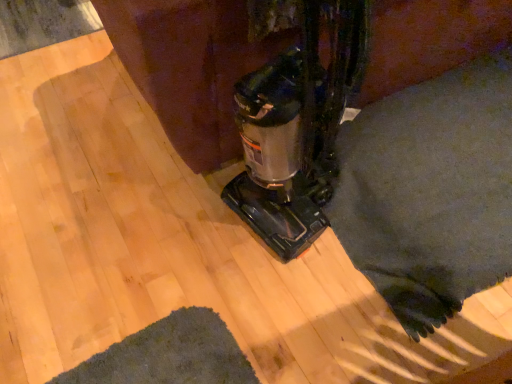
Describe the element at coordinates (296, 121) in the screenshot. I see `metallic black vacuum cleaner at center` at that location.

Identify the location of metallic black vacuum cleaner at center. (296, 121).

Find the location of a particular element. This screenshot has height=384, width=512. metallic black vacuum cleaner at center is located at coordinates (296, 121).